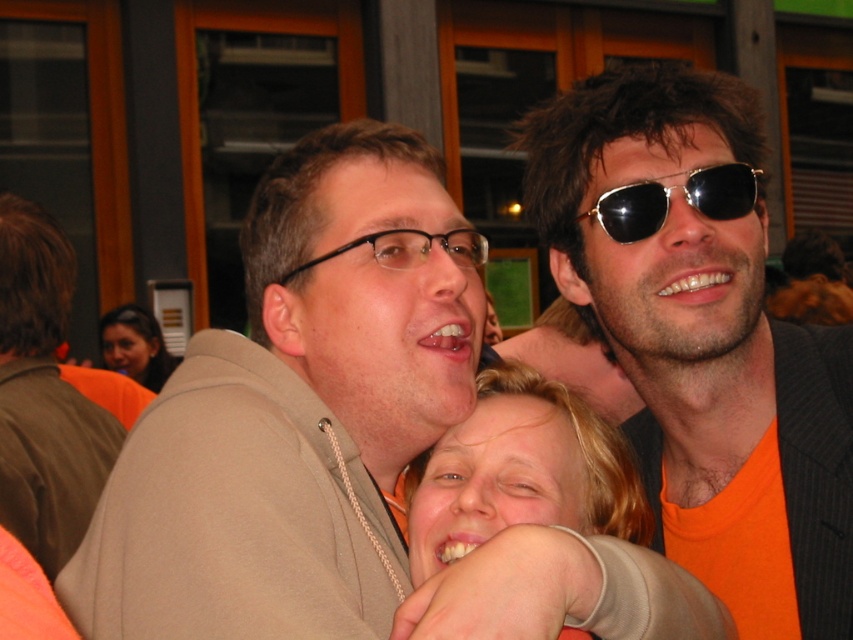
Based on the photo, which is more to the left, blonde hair at center or matte brown jacket at left?

From the viewer's perspective, matte brown jacket at left appears more on the left side.

Is blonde hair at center shorter than matte brown jacket at left?

Correct, blonde hair at center is not as tall as matte brown jacket at left.

Where is `blonde hair at center`? blonde hair at center is located at coordinates (x=547, y=497).

The image size is (853, 640). Identify the location of blonde hair at center. (547, 497).

Can you confirm if matte beige hoodie at center is smaller than black plastic glasses at center?

Actually, matte beige hoodie at center might be larger than black plastic glasses at center.

Between point (271, 524) and point (469, 253), which one is positioned in front?

Point (271, 524)

The width and height of the screenshot is (853, 640). What are the coordinates of `matte beige hoodie at center` in the screenshot? It's located at (294, 410).

Is gold reflective sunglasses at upper right to the right of matte orange shirt at upper left from the viewer's perspective?

Correct, you'll find gold reflective sunglasses at upper right to the right of matte orange shirt at upper left.

Which is in front, point (728, 163) or point (123, 332)?

Point (728, 163)

The height and width of the screenshot is (640, 853). I want to click on gold reflective sunglasses at upper right, so click(669, 200).